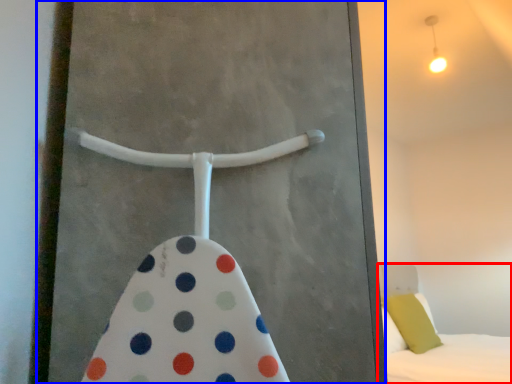
Question: Which of the following is the farthest to the observer, bed (highlighted by a red box) or screen door (highlighted by a blue box)?

Choices:
 (A) bed
 (B) screen door

Answer: (A)